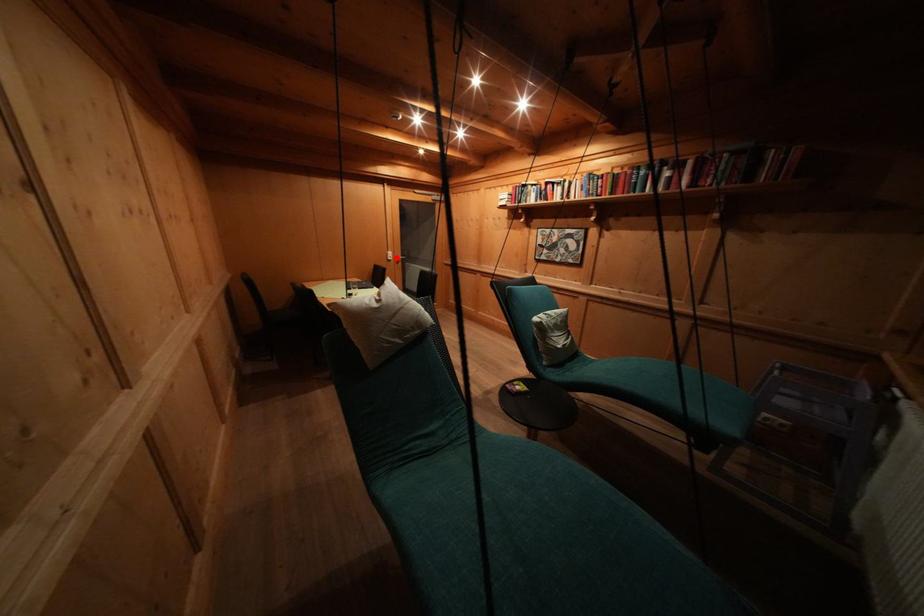
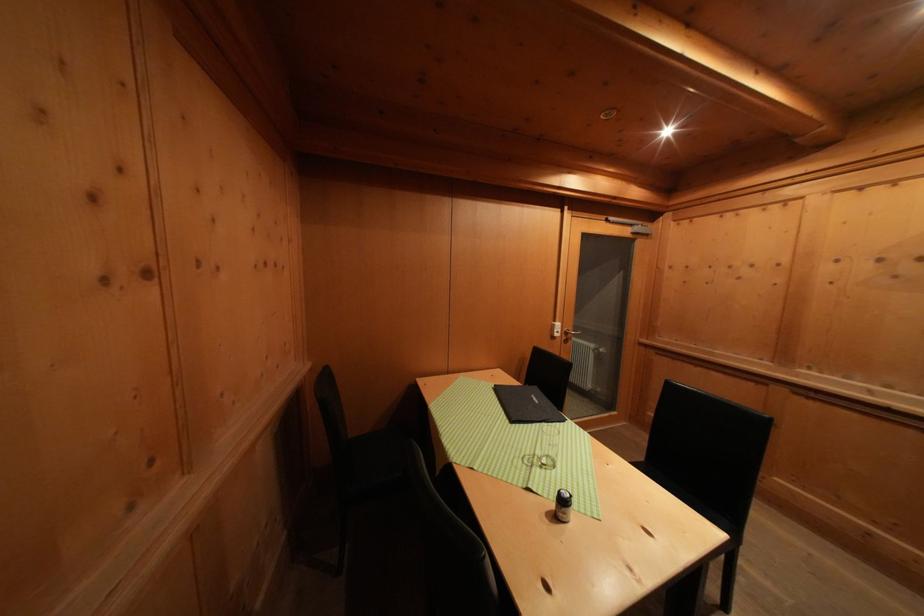
In the second image, find the point that corresponds to the highlighted location in the first image.

(564, 330)